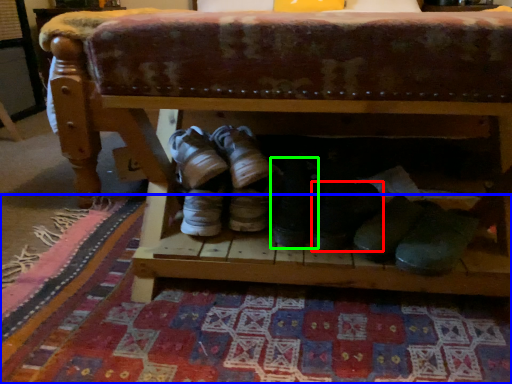
Question: Which is farther away from footwear (highlighted by a red box)? mat (highlighted by a blue box) or footwear (highlighted by a green box)?

Choices:
 (A) mat
 (B) footwear

Answer: (A)